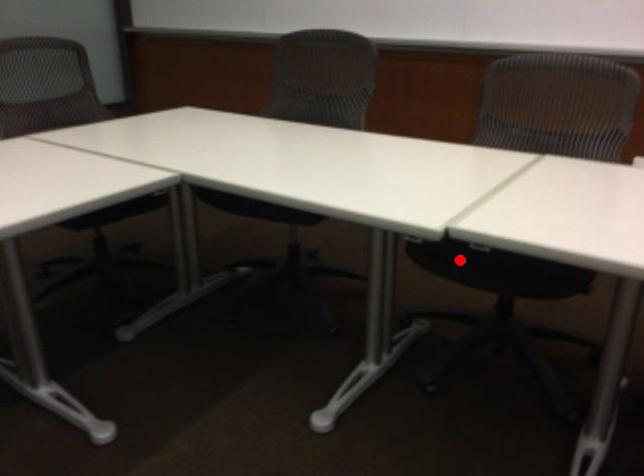
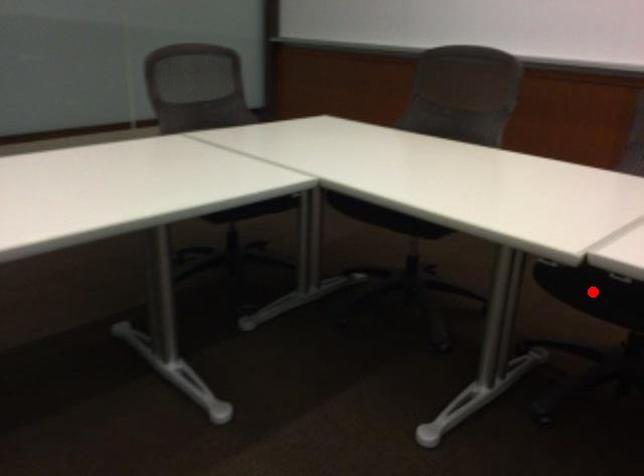
I am providing you with two images of the same scene from different viewpoints. A red point is marked on the first image and another point is marked on the second image. Does the point marked in image1 correspond to the same location as the one in image2?

Yes